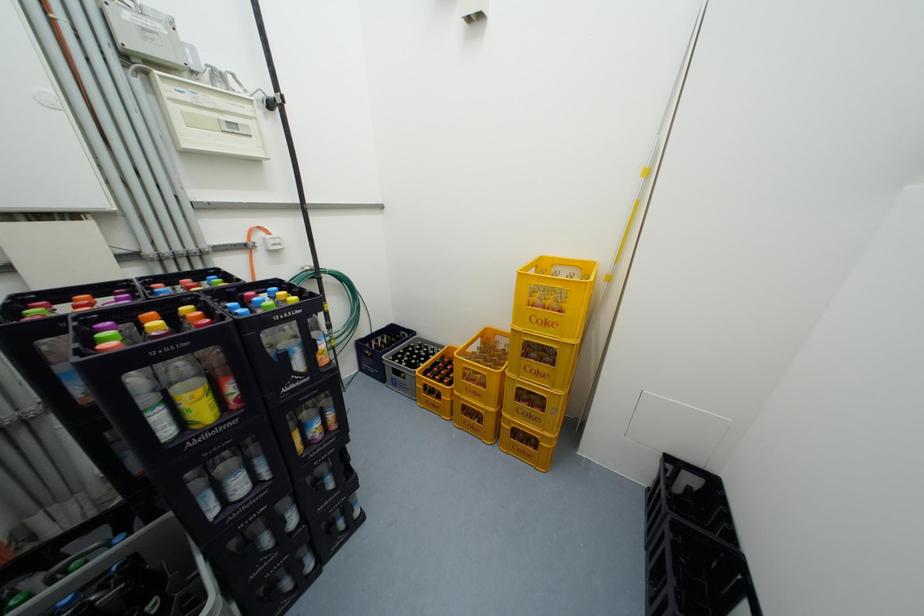
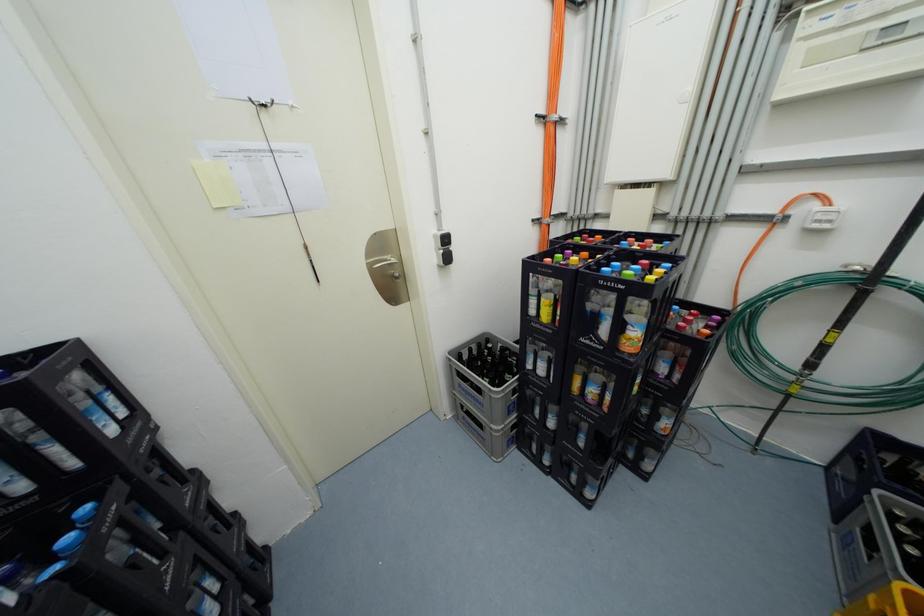
Based on the continuous images, in which direction is the camera rotating?

The camera's rotation is toward left-down.